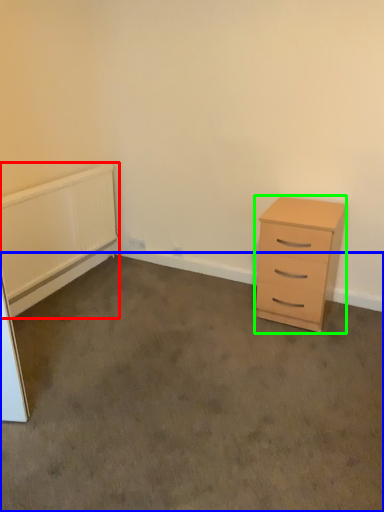
Question: Considering the real-world distances, which object is closest to radiator (highlighted by a red box)? plain (highlighted by a blue box) or chest of drawers (highlighted by a green box).

Choices:
 (A) plain
 (B) chest of drawers

Answer: (A)